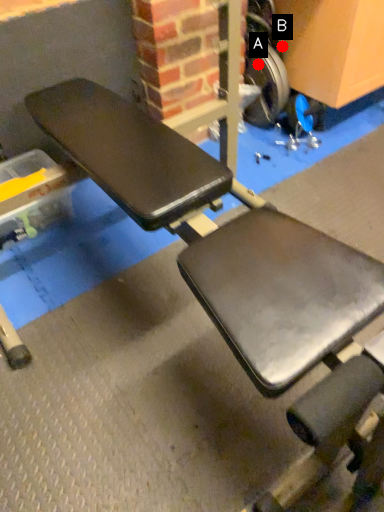
Question: Two points are circled on the image, labeled by A and B beside each circle. Which of the following is the farthest from the observer?

Choices:
 (A) A is further
 (B) B is further

Answer: (B)